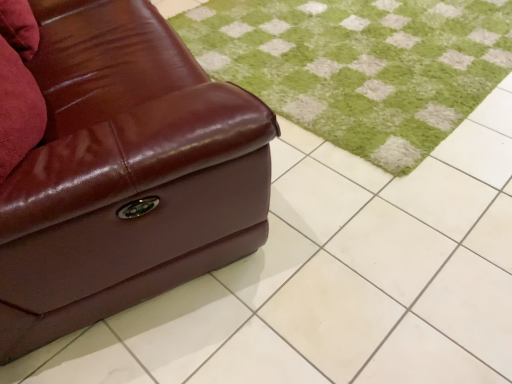
What do you see at coordinates (125, 173) in the screenshot?
I see `brown leather couch at left` at bounding box center [125, 173].

Where is `brown leather couch at left`? This screenshot has height=384, width=512. brown leather couch at left is located at coordinates (125, 173).

Image resolution: width=512 pixels, height=384 pixels. What do you see at coordinates (359, 65) in the screenshot?
I see `green soft rug at center` at bounding box center [359, 65].

Find the location of a particular element. This screenshot has width=512, height=384. green soft rug at center is located at coordinates (359, 65).

What is the approximate height of green soft rug at center?

green soft rug at center is 5.49 centimeters in height.

This screenshot has width=512, height=384. What are the coordinates of `brown leather couch at left` in the screenshot? It's located at (125, 173).

Considering the relative positions of green soft rug at center and brown leather couch at left in the image provided, is green soft rug at center to the left of brown leather couch at left from the viewer's perspective?

In fact, green soft rug at center is to the right of brown leather couch at left.

Between green soft rug at center and brown leather couch at left, which one is positioned in front?

Positioned in front is brown leather couch at left.

Is point (348, 26) closer or farther from the camera than point (28, 275)?

Clearly, point (348, 26) is more distant from the camera than point (28, 275).

From the image's perspective, would you say green soft rug at center is shown under brown leather couch at left?

No, from the image's perspective, green soft rug at center is not below brown leather couch at left.

From a real-world perspective, is green soft rug at center physically above brown leather couch at left?

Actually, green soft rug at center is physically below brown leather couch at left in the real world.

Can you confirm if green soft rug at center is wider than brown leather couch at left?

Yes, green soft rug at center is wider than brown leather couch at left.

Between green soft rug at center and brown leather couch at left, which one has more height?

brown leather couch at left is taller.

Considering the relative sizes of green soft rug at center and brown leather couch at left in the image provided, is green soft rug at center bigger than brown leather couch at left?

Incorrect, green soft rug at center is not larger than brown leather couch at left.

Is green soft rug at center spatially inside brown leather couch at left, or outside of it?

green soft rug at center is outside brown leather couch at left.

Would you say green soft rug at center is a long distance from brown leather couch at left?

green soft rug at center is actually quite close to brown leather couch at left.

Is brown leather couch at left at the back of green soft rug at center?

green soft rug at center does not have its back to brown leather couch at left.

This screenshot has height=384, width=512. There is a green soft rug at center. What are the coordinates of `studio couch above it (from a real-world perspective)` in the screenshot? It's located at (125, 173).

Between brown leather couch at left and green soft rug at center, which one appears on the left side from the viewer's perspective?

brown leather couch at left is more to the left.

In the scene shown: Considering their positions, is brown leather couch at left located in front of or behind green soft rug at center?

Visually, brown leather couch at left is located in front of green soft rug at center.

Is point (100, 55) closer to viewer compared to point (456, 107)?

Yes, point (100, 55) is closer to viewer.

From the image's perspective, is brown leather couch at left above green soft rug at center?

No, from the image's perspective, brown leather couch at left is not above green soft rug at center.

From a real-world perspective, relative to green soft rug at center, is brown leather couch at left vertically above or below?

brown leather couch at left is situated higher than green soft rug at center in the real world.

Which object is thinner, brown leather couch at left or green soft rug at center?

Thinner between the two is brown leather couch at left.

Is brown leather couch at left taller than green soft rug at center?

Yes, brown leather couch at left is taller than green soft rug at center.

Which of these two, brown leather couch at left or green soft rug at center, is smaller?

With smaller size is green soft rug at center.

Is brown leather couch at left not within green soft rug at center?

Yes.

Is brown leather couch at left beside green soft rug at center?

No.

Is brown leather couch at left aimed at green soft rug at center?

Yes, brown leather couch at left is turned towards green soft rug at center.

The width and height of the screenshot is (512, 384). In the image, there is a green soft rug at center. In order to click on studio couch below it (from the image's perspective) in this screenshot , I will do `click(125, 173)`.

I want to click on grass above the brown leather couch at left (from the image's perspective), so click(359, 65).

At what (x,y) coordinates should I click in order to perform the action: click on studio couch located in front of the green soft rug at center. Please return your answer as a coordinate pair (x, y). Image resolution: width=512 pixels, height=384 pixels. Looking at the image, I should click on (125, 173).